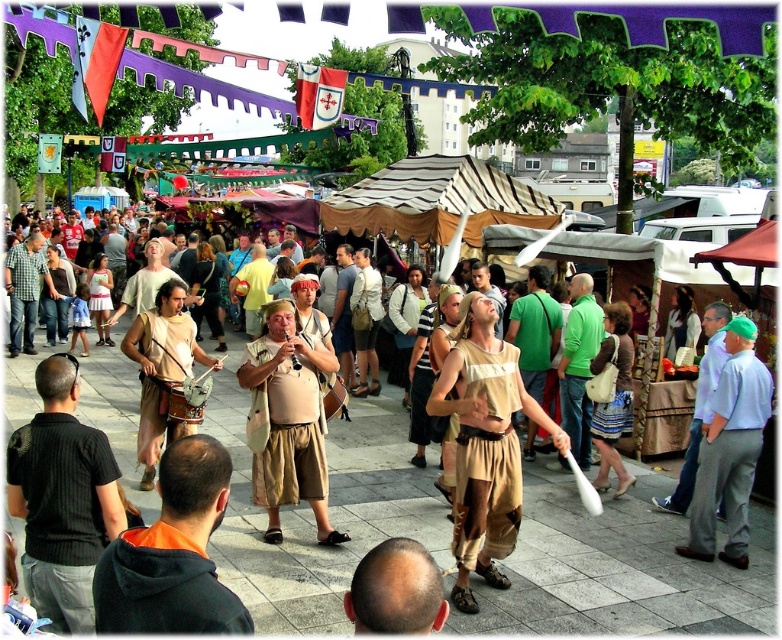
Which is in front, point (526, 378) or point (705, 328)?

Point (705, 328)

Can you confirm if tan fabric pants at center is shorter than light blue shirt at center?

Correct, tan fabric pants at center is not as tall as light blue shirt at center.

Between point (529, 364) and point (702, 320), which one is positioned in front?

Point (702, 320)

Identify the location of tan fabric pants at center. The height and width of the screenshot is (640, 782). (533, 330).

Is black cotton shirt at lower left shorter than tan fabric pants at center?

Correct, black cotton shirt at lower left is not as tall as tan fabric pants at center.

Is black cotton shirt at lower left closer to camera compared to tan fabric pants at center?

Yes, it is.

Between point (38, 580) and point (528, 304), which one is positioned in front?

Point (38, 580) is in front.

Where is `black cotton shirt at lower left`? This screenshot has height=640, width=782. black cotton shirt at lower left is located at coordinates (63, 499).

Who is higher up, light brown leather bag at center or smooth bald head at lower center?

light brown leather bag at center

Can you confirm if light brown leather bag at center is positioned to the left of smooth bald head at lower center?

Yes, light brown leather bag at center is to the left of smooth bald head at lower center.

Which is in front, point (292, 406) or point (421, 595)?

Point (421, 595)

Locate an element on the screen. light brown leather bag at center is located at coordinates coord(287,419).